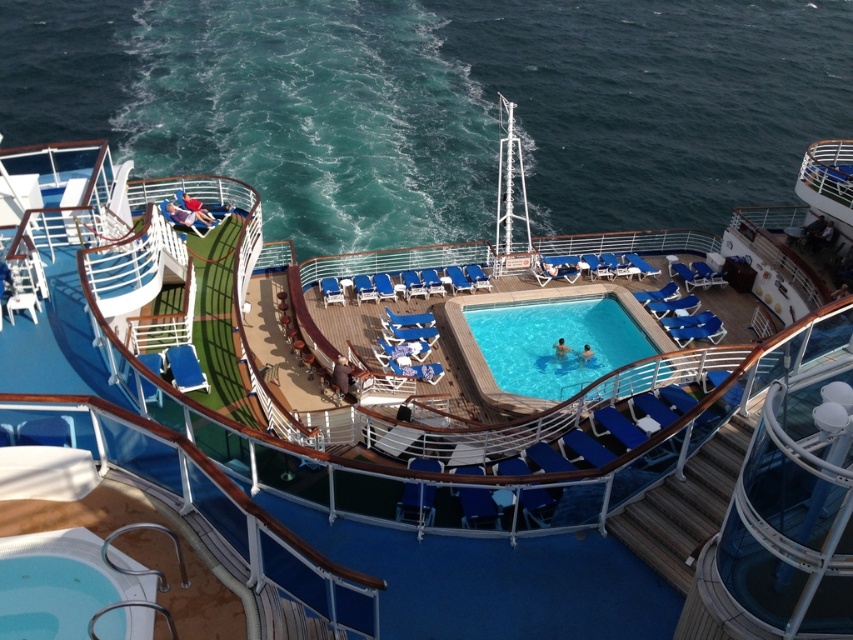
Question: Does clear blue water at upper center have a lesser width compared to clear blue water at center?

Choices:
 (A) no
 (B) yes

Answer: (A)

Question: Where is clear blue water at upper center located in relation to clear blue water at center in the image?

Choices:
 (A) right
 (B) left

Answer: (B)

Question: Which point is farther to the camera?

Choices:
 (A) clear blue water at center
 (B) clear blue water at upper center

Answer: (B)

Question: Which object appears closest to the camera in this image?

Choices:
 (A) clear blue water at center
 (B) clear blue water at upper center

Answer: (A)

Question: Which object is closer to the camera taking this photo?

Choices:
 (A) clear blue water at upper center
 (B) clear blue water at center

Answer: (B)

Question: Does clear blue water at upper center have a lesser width compared to clear blue water at center?

Choices:
 (A) no
 (B) yes

Answer: (A)